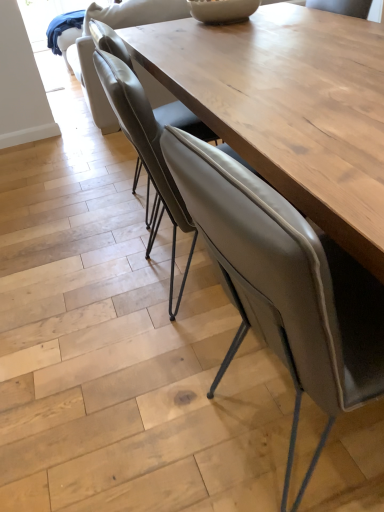
Question: Is matte gray chair at center, positioned as the second chair in back-to-front order, wider than leather armchair at upper center?

Choices:
 (A) yes
 (B) no

Answer: (B)

Question: Is leather armchair at upper center at the back of matte gray chair at center, positioned as the second chair in back-to-front order?

Choices:
 (A) yes
 (B) no

Answer: (B)

Question: Is matte gray chair at center, positioned as the second chair in back-to-front order, taller than leather armchair at upper center?

Choices:
 (A) no
 (B) yes

Answer: (A)

Question: Is matte gray chair at center, the 2th chair from the front, positioned before leather armchair at upper center?

Choices:
 (A) yes
 (B) no

Answer: (A)

Question: Can you confirm if matte gray chair at center, positioned as the second chair in back-to-front order, is positioned to the right of leather armchair at upper center?

Choices:
 (A) yes
 (B) no

Answer: (A)

Question: Does matte gray chair at center, the 2th chair from the front, have a lesser width compared to leather armchair at upper center?

Choices:
 (A) yes
 (B) no

Answer: (A)

Question: Is matte gray chair at center, positioned as the second chair in back-to-front order, positioned far away from matte gray chair at center, which appears as the 3th chair when viewed from the back?

Choices:
 (A) no
 (B) yes

Answer: (A)

Question: Can we say matte gray chair at center, positioned as the second chair in back-to-front order, lies outside matte gray chair at center, the 1th chair when ordered from front to back?

Choices:
 (A) no
 (B) yes

Answer: (B)

Question: Is matte gray chair at center, the 2th chair from the front, with matte gray chair at center, the 1th chair when ordered from front to back?

Choices:
 (A) yes
 (B) no

Answer: (B)

Question: Is the depth of matte gray chair at center, positioned as the second chair in back-to-front order, greater than that of matte gray chair at center, the 1th chair when ordered from front to back?

Choices:
 (A) no
 (B) yes

Answer: (B)

Question: Is matte gray chair at center, positioned as the second chair in back-to-front order, smaller than matte gray chair at center, the 1th chair when ordered from front to back?

Choices:
 (A) no
 (B) yes

Answer: (B)

Question: From a real-world perspective, is matte gray chair at center, the 2th chair from the front, located higher than matte gray chair at center, which appears as the 3th chair when viewed from the back?

Choices:
 (A) no
 (B) yes

Answer: (B)

Question: Is leather armchair at upper center taller than matte gray chair at center, the 1th chair when ordered from front to back?

Choices:
 (A) yes
 (B) no

Answer: (B)